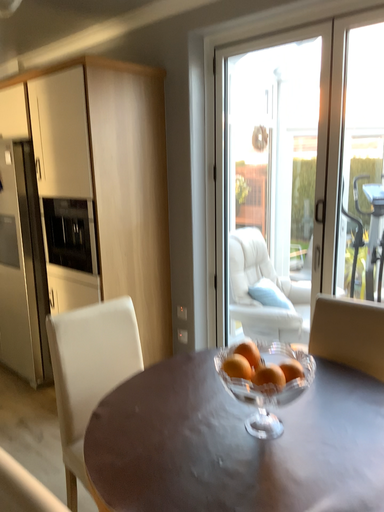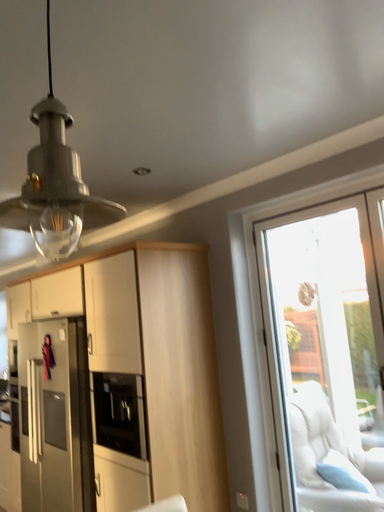
Question: How did the camera likely rotate when shooting the video?

Choices:
 (A) rotated upward
 (B) rotated downward

Answer: (A)